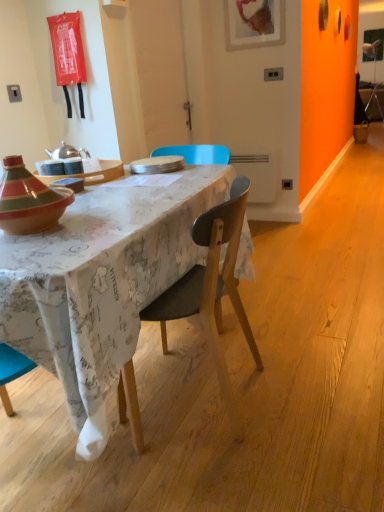
The height and width of the screenshot is (512, 384). Find the location of `matte wooden tray at center`. matte wooden tray at center is located at coordinates (100, 170).

What do you see at coordinates (100, 170) in the screenshot? Image resolution: width=384 pixels, height=512 pixels. I see `matte wooden tray at center` at bounding box center [100, 170].

The image size is (384, 512). Find the location of `white matte plate at center`. white matte plate at center is located at coordinates (157, 165).

What do you see at coordinates (157, 165) in the screenshot?
I see `white matte plate at center` at bounding box center [157, 165].

At what (x,y) coordinates should I click in order to perform the action: click on wooden chair at center. Please return your answer as a coordinate pair (x, y). Image resolution: width=384 pixels, height=512 pixels. Looking at the image, I should click on (211, 286).

Locate an element on the screen. Image resolution: width=384 pixels, height=512 pixels. matte wooden tray at center is located at coordinates (100, 170).

Between white matte plate at center and wooden chair at center, which one has smaller width?

Thinner between the two is white matte plate at center.

Are white matte plate at center and wooden chair at center making contact?

There is a gap between white matte plate at center and wooden chair at center.

Find the location of a particular element. chair in front of the white matte plate at center is located at coordinates (211, 286).

Measure the distance between maple wood desk at center and matte wooden tray at center.

19.96 inches.

Looking at this image, is maple wood desk at center far from matte wooden tray at center?

That's not correct — maple wood desk at center is a little close to matte wooden tray at center.

Looking at this image, from a real-world perspective, does maple wood desk at center sit lower than matte wooden tray at center?

Indeed, from a real-world perspective, maple wood desk at center is positioned beneath matte wooden tray at center.

Considering the sizes of maple wood desk at center and wooden chair at center in the image, is maple wood desk at center wider or thinner than wooden chair at center?

Clearly, maple wood desk at center has more width compared to wooden chair at center.

How much distance is there between maple wood desk at center and wooden chair at center?

maple wood desk at center is 8.57 inches away from wooden chair at center.

Is maple wood desk at center positioned far away from wooden chair at center?

No, maple wood desk at center is in close proximity to wooden chair at center.

From a real-world perspective, between maple wood desk at center and wooden chair at center, who is vertically higher?

wooden chair at center, from a real-world perspective.

Are matte wooden tray at center and wooden chair at center making contact?

Answer: There is a gap between matte wooden tray at center and wooden chair at center.

Relative to wooden chair at center, is matte wooden tray at center in front or behind?

Clearly, matte wooden tray at center is behind wooden chair at center.

Considering the relative sizes of matte wooden tray at center and wooden chair at center in the image provided, is matte wooden tray at center thinner than wooden chair at center?

Yes, matte wooden tray at center is thinner than wooden chair at center.

Is white matte plate at center next to maple wood desk at center?

No, white matte plate at center is not next to maple wood desk at center.

Would you say white matte plate at center is outside maple wood desk at center?

No, white matte plate at center is not outside of maple wood desk at center.

Which of these two, white matte plate at center or maple wood desk at center, stands taller?

maple wood desk at center is taller.

From the image's perspective, is white matte plate at center on maple wood desk at center?

Indeed, from the image's perspective, white matte plate at center is shown above maple wood desk at center.

Would you say maple wood desk at center is a long distance from white matte plate at center?

No, maple wood desk at center is not far from white matte plate at center.

Does maple wood desk at center have a lesser height compared to white matte plate at center?

No.

Measure the distance between maple wood desk at center and white matte plate at center.

maple wood desk at center and white matte plate at center are 63.48 centimeters apart.

Which object is further away from the camera taking this photo, maple wood desk at center or white matte plate at center?

white matte plate at center is behind.

Based on the photo, from a real-world perspective, which is physically below, wooden chair at center or matte wooden tray at center?

wooden chair at center.

Considering the relative sizes of wooden chair at center and matte wooden tray at center in the image provided, is wooden chair at center thinner than matte wooden tray at center?

Incorrect, the width of wooden chair at center is not less than that of matte wooden tray at center.

Does wooden chair at center have a larger size compared to matte wooden tray at center?

Indeed, wooden chair at center has a larger size compared to matte wooden tray at center.

Which is in front, point (139, 429) or point (121, 169)?

Positioned in front is point (139, 429).

At what (x,y) coordinates should I click in order to perform the action: click on plate above the wooden chair at center (from a real-world perspective). Please return your answer as a coordinate pair (x, y). The width and height of the screenshot is (384, 512). Looking at the image, I should click on (157, 165).

Locate an element on the screen. This screenshot has width=384, height=512. table that is above the maple wood desk at center (from the image's perspective) is located at coordinates (100, 170).

Estimate the real-world distances between objects in this image. Which object is closer to matte wooden tray at center, wooden chair at center or maple wood desk at center?

Based on the image, maple wood desk at center appears to be nearer to matte wooden tray at center.

Looking at the image, which one is located further to maple wood desk at center, wooden chair at center or white matte plate at center?

Among the two, white matte plate at center is located further to maple wood desk at center.

Considering their positions, is white matte plate at center positioned closer to maple wood desk at center than matte wooden tray at center?

matte wooden tray at center is closer to maple wood desk at center.

Estimate the real-world distances between objects in this image. Which object is closer to matte wooden tray at center, white matte plate at center or wooden chair at center?

white matte plate at center is positioned closer to the anchor matte wooden tray at center.

Considering their positions, is maple wood desk at center positioned further to wooden chair at center than matte wooden tray at center?

matte wooden tray at center.

From the image, which object appears to be nearer to wooden chair at center, maple wood desk at center or white matte plate at center?

Based on the image, maple wood desk at center appears to be nearer to wooden chair at center.

Considering their positions, is matte wooden tray at center positioned closer to wooden chair at center than maple wood desk at center?

maple wood desk at center is positioned closer to the anchor wooden chair at center.

Based on the photo, based on their spatial positions, is maple wood desk at center or matte wooden tray at center closer to white matte plate at center?

The object closer to white matte plate at center is matte wooden tray at center.

This screenshot has width=384, height=512. I want to click on table located between wooden chair at center and white matte plate at center in the depth direction, so click(x=100, y=170).

Image resolution: width=384 pixels, height=512 pixels. I want to click on table positioned between maple wood desk at center and white matte plate at center from near to far, so click(x=100, y=170).

I want to click on chair positioned between maple wood desk at center and matte wooden tray at center from near to far, so click(x=211, y=286).

Locate an element on the screen. The image size is (384, 512). chair between maple wood desk at center and white matte plate at center from front to back is located at coordinates (211, 286).